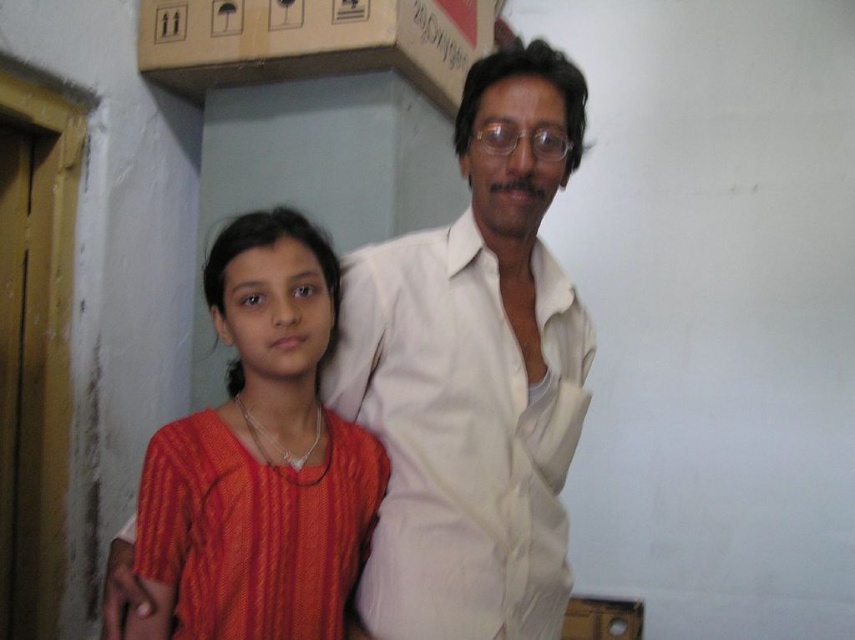
Who is more forward, (470, 100) or (423, 252)?

Point (470, 100) is in front.

Which is in front, point (392, 321) or point (531, 474)?

Point (531, 474) is in front.

Identify the location of white smooth shirt at center. This screenshot has height=640, width=855. (475, 374).

Between white cotton shirt at upper center and matte orange dress at center, which one appears on the right side from the viewer's perspective?

white cotton shirt at upper center

Is white cotton shirt at upper center below matte orange dress at center?

Indeed, white cotton shirt at upper center is positioned under matte orange dress at center.

Find the location of `white cotton shirt at upper center`. white cotton shirt at upper center is located at coordinates (461, 435).

Who is more distant from viewer, (x=484, y=625) or (x=268, y=582)?

The point (x=484, y=625) is behind.

Which is below, white smooth shirt at center or matte orange dress at center?

matte orange dress at center is below.

Looking at this image, who is more distant from viewer, (553, 531) or (146, 556)?

Point (553, 531)

The height and width of the screenshot is (640, 855). I want to click on white smooth shirt at center, so tap(475, 374).